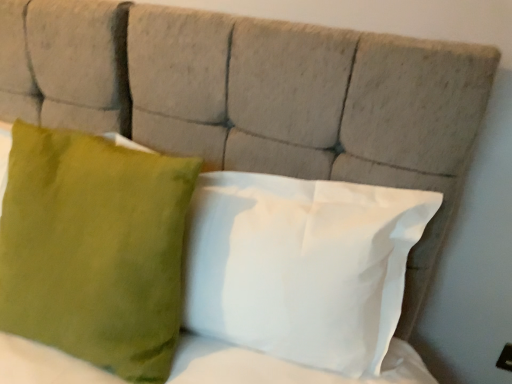
Question: Considering the positions of green velvet pillow at left, which ranks as the first pillow in left-to-right order, and white matte pillow at center, which is the 2th pillow from left to right, in the image, is green velvet pillow at left, which ranks as the first pillow in left-to-right order, wider or thinner than white matte pillow at center, which is the 2th pillow from left to right,?

Choices:
 (A) wide
 (B) thin

Answer: (A)

Question: From a real-world perspective, is green velvet pillow at left, which appears as the second pillow when viewed from the right, positioned above or below white matte pillow at center, which is the 2th pillow from left to right?

Choices:
 (A) above
 (B) below

Answer: (B)

Question: Is green velvet pillow at left, which ranks as the first pillow in left-to-right order, inside or outside of white matte pillow at center, acting as the 1th pillow starting from the right?

Choices:
 (A) outside
 (B) inside

Answer: (A)

Question: Considering the positions of point (309, 279) and point (154, 213), is point (309, 279) closer or farther from the camera than point (154, 213)?

Choices:
 (A) closer
 (B) farther

Answer: (B)

Question: Is white matte pillow at center, acting as the 1th pillow starting from the right, in front of or behind green velvet pillow at left, which ranks as the first pillow in left-to-right order, in the image?

Choices:
 (A) front
 (B) behind

Answer: (B)

Question: From a real-world perspective, relative to green velvet pillow at left, which ranks as the first pillow in left-to-right order, is white matte pillow at center, which is the 2th pillow from left to right, vertically above or below?

Choices:
 (A) above
 (B) below

Answer: (A)

Question: Based on their positions, is white matte pillow at center, acting as the 1th pillow starting from the right, located to the left or right of green velvet pillow at left, which appears as the second pillow when viewed from the right?

Choices:
 (A) right
 (B) left

Answer: (A)